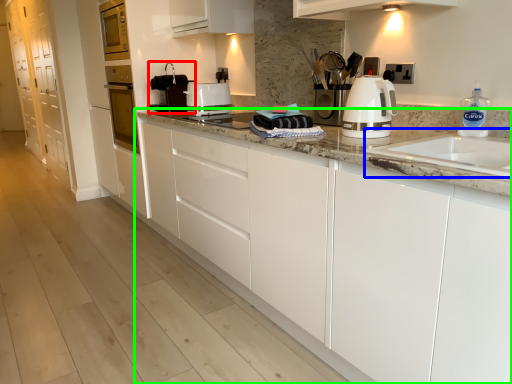
Question: Estimate the real-world distances between objects in this image. Which object is farther from home appliance (highlighted by a red box), sink (highlighted by a blue box) or cabinetry (highlighted by a green box)?

Choices:
 (A) sink
 (B) cabinetry

Answer: (A)